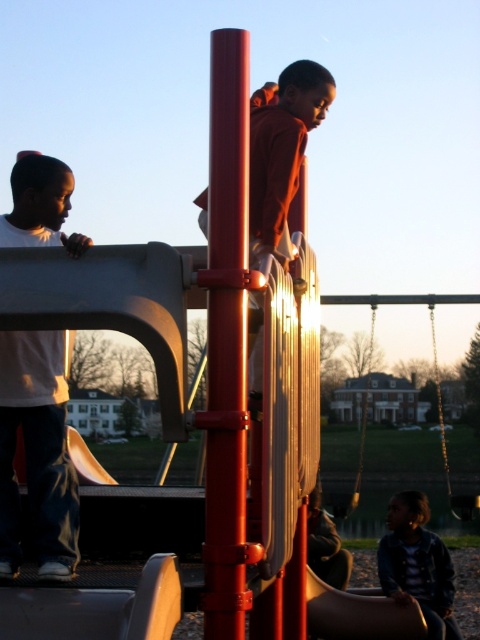
Question: Does white matte shirt at left appear on the left side of matte orange hoodie at center?

Choices:
 (A) no
 (B) yes

Answer: (B)

Question: Is white matte shirt at left further to camera compared to wooden swing at right?

Choices:
 (A) no
 (B) yes

Answer: (A)

Question: Which of the following is the farthest from the observer?

Choices:
 (A) white matte shirt at left
 (B) wooden swing at right
 (C) orange matte slide at center
 (D) matte orange hoodie at center

Answer: (B)

Question: Which is nearer to the orange matte slide at center?

Choices:
 (A) denim jacket at lower right
 (B) wooden swing at right

Answer: (A)

Question: Can you confirm if matte orange hoodie at center is positioned below wooden swing at right?

Choices:
 (A) yes
 (B) no

Answer: (B)

Question: Which of the following is the farthest from the observer?

Choices:
 (A) (275, 234)
 (B) (80, 234)
 (C) (409, 600)
 (D) (360, 420)

Answer: (D)